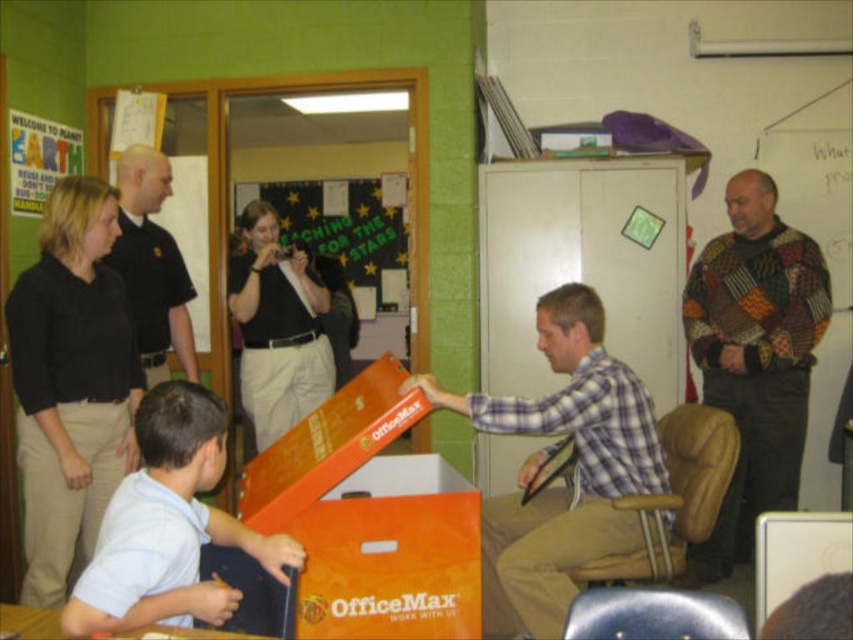
What do you see at coordinates (70, 384) in the screenshot?
I see `black matte shirt at left` at bounding box center [70, 384].

You are a GUI agent. You are given a task and a screenshot of the screen. Output one action in this format:
    pyautogui.click(x=<x>, y=<y>)
    Task: Click on the black matte shirt at left
    
    Given the screenshot: What is the action you would take?
    pyautogui.click(x=70, y=384)

What do you see at coordinates (70, 384) in the screenshot?
I see `black matte shirt at left` at bounding box center [70, 384].

Image resolution: width=853 pixels, height=640 pixels. In order to click on black matte shirt at left in this screenshot , I will do `click(70, 384)`.

Is patchwork sweater at right thinner than green paper at upper center?

Yes.

Is point (712, 564) positioned behind point (401, 241)?

No.

At what (x,y) coordinates should I click in order to perform the action: click on patchwork sweater at right. Please return your answer as a coordinate pair (x, y). Image resolution: width=853 pixels, height=640 pixels. Looking at the image, I should click on (753, 358).

Locate an element on the screen. The width and height of the screenshot is (853, 640). patchwork sweater at right is located at coordinates (753, 358).

Between orange cardboard box at center and green paper at upper center, which one has less height?

orange cardboard box at center

Who is more distant from viewer, (364, 458) or (329, 284)?

Positioned behind is point (329, 284).

Where is `orange cardboard box at center`? orange cardboard box at center is located at coordinates (370, 518).